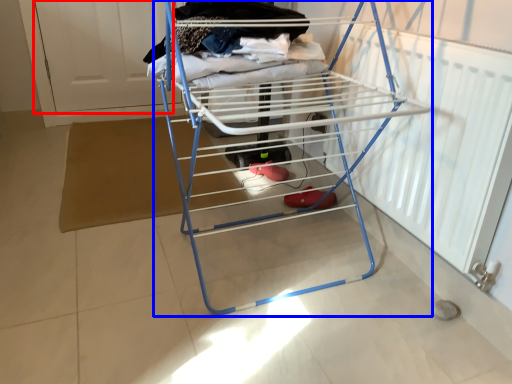
Question: Which of the following is the farthest to the observer, screen door (highlighted by a red box) or furniture (highlighted by a blue box)?

Choices:
 (A) screen door
 (B) furniture

Answer: (A)